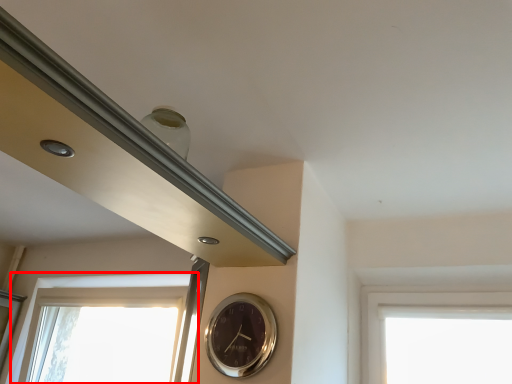
Question: From the image's perspective, what is the correct spatial positioning of window (annotated by the red box) in reference to wall clock?

Choices:
 (A) above
 (B) below

Answer: (B)